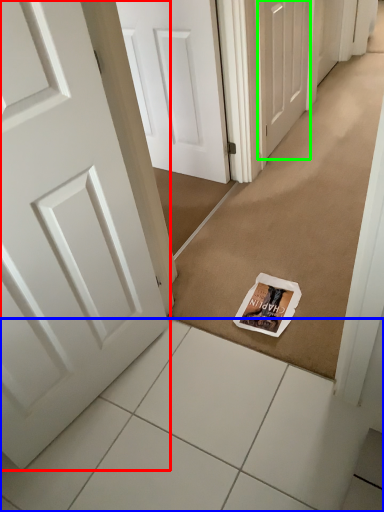
Question: Considering the real-world distances, which object is farthest from door (highlighted by a red box)? tile (highlighted by a blue box) or door (highlighted by a green box)?

Choices:
 (A) tile
 (B) door

Answer: (B)